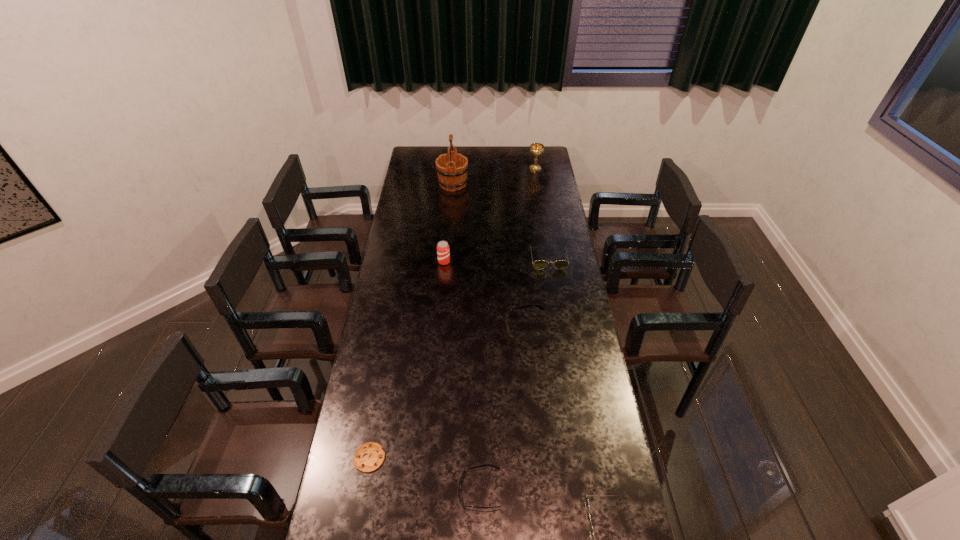
Find the location of a particular element. The height and width of the screenshot is (540, 960). wine bucket is located at coordinates (452, 167).

Locate an element on the screen. the seventh nearest object is located at coordinates (452, 167).

This screenshot has width=960, height=540. I want to click on the seventh shortest object, so click(536, 149).

Image resolution: width=960 pixels, height=540 pixels. What are the coordinates of `the farthest object` in the screenshot? It's located at (536, 149).

The image size is (960, 540). Identify the location of beer can. (443, 252).

At what (x,y) coordinates should I click in order to perform the action: click on orange beer can. Please return your answer as a coordinate pair (x, y). The image size is (960, 540). Looking at the image, I should click on (443, 252).

This screenshot has width=960, height=540. Find the location of `the farthest sunglasses`. the farthest sunglasses is located at coordinates (539, 264).

Locate an element on the screen. The image size is (960, 540). the bigger green sunglasses is located at coordinates point(539,264).

At what (x,y) coordinates should I click in order to perform the action: click on the right black sunglasses. Please return your answer as a coordinate pair (x, y). The image size is (960, 540). Looking at the image, I should click on (508, 311).

Find the location of a particular element. This screenshot has width=960, height=540. the second farthest sunglasses is located at coordinates (508, 311).